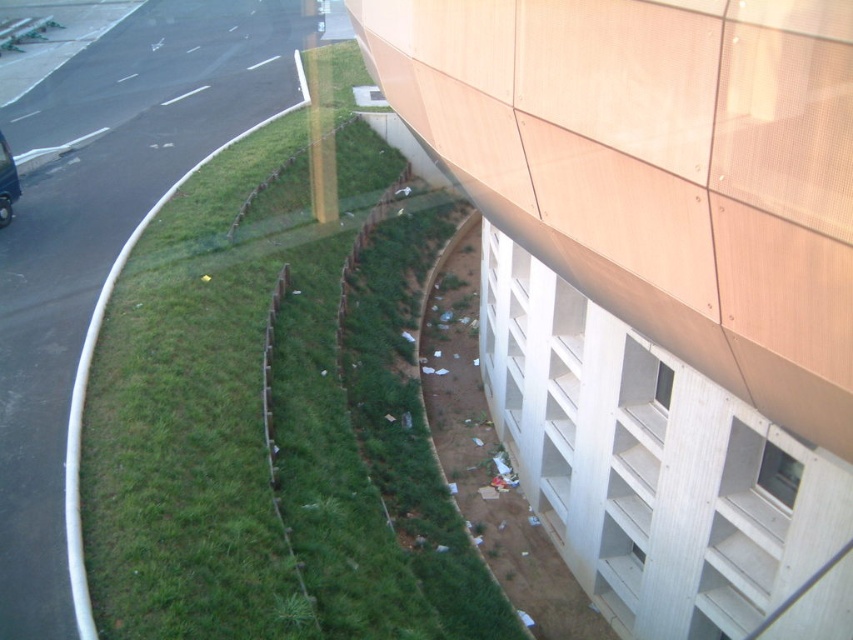
You are driving a car and see the shiny black car at left. There is also green grass at lower left. Which object is closer to you?

The green grass at lower left is closer to you because it is in front of the shiny black car at left.

You are a delivery driver who needs to park your shiny black car at left in the parking lot near the building. The parking lot has a size restriction that only allows vehicles smaller than the green grass at lower left. Can your car fit in the parking spot?

The green grass at lower left is larger in size than the shiny black car at left, so the shiny black car at left can fit in the parking spot since it is smaller than the size requirement.

From the picture: You are a delivery driver who needs to park your shiny black car at left near the green grass at lower left. The parking spot requires a minimum distance of 5 meters between the car and any nearby obstacles. Can you safely park there?

The green grass at lower left is 8.16 meters from the shiny black car at left. Since the required minimum distance is 5 meters, the car can be parked safely as the distance exceeds the requirement.